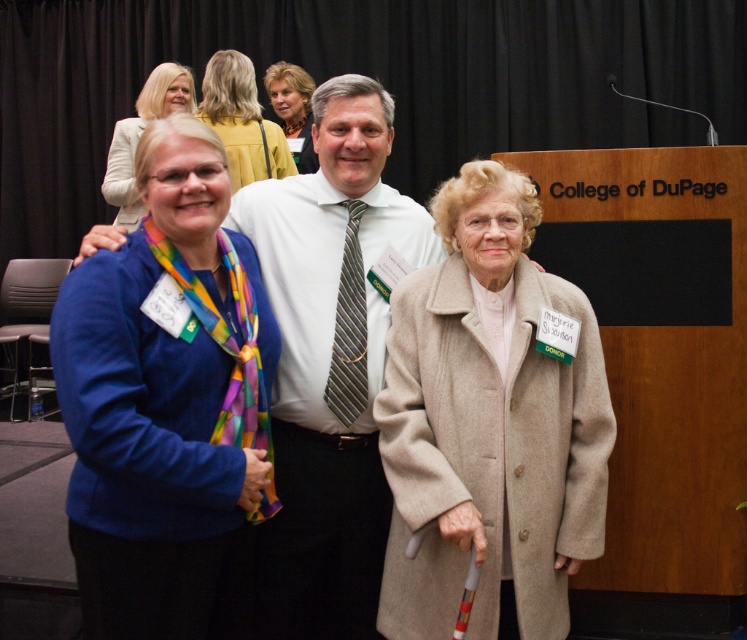
Which is in front, point (89, 298) or point (530, 472)?

Positioned in front is point (89, 298).

Is blue soft scarf at left bigger than beige wool coat at center?

Yes.

The height and width of the screenshot is (640, 747). Describe the element at coordinates (167, 406) in the screenshot. I see `blue soft scarf at left` at that location.

Identify the location of blue soft scarf at left. pyautogui.click(x=167, y=406).

Does point (214, 625) lie in front of point (267, 170)?

That is True.

Where is `blue soft scarf at left`? The width and height of the screenshot is (747, 640). blue soft scarf at left is located at coordinates (167, 406).

Based on the photo, is the position of striped fabric tie at center more distant than that of matte yellow blouse at upper center?

No.

Can you confirm if striped fabric tie at center is positioned below matte yellow blouse at upper center?

Yes.

Where is `striped fabric tie at center`? The width and height of the screenshot is (747, 640). striped fabric tie at center is located at coordinates (350, 328).